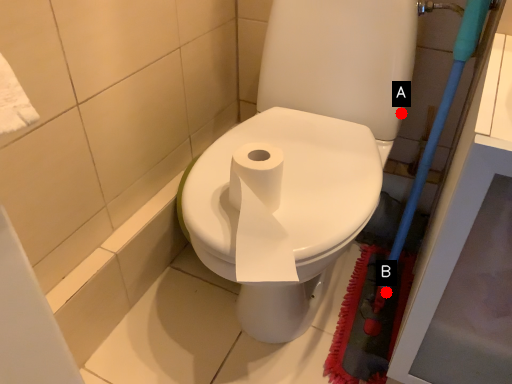
Question: Two points are circled on the image, labeled by A and B beside each circle. Which point is farther from the camera taking this photo?

Choices:
 (A) A is further
 (B) B is further

Answer: (B)